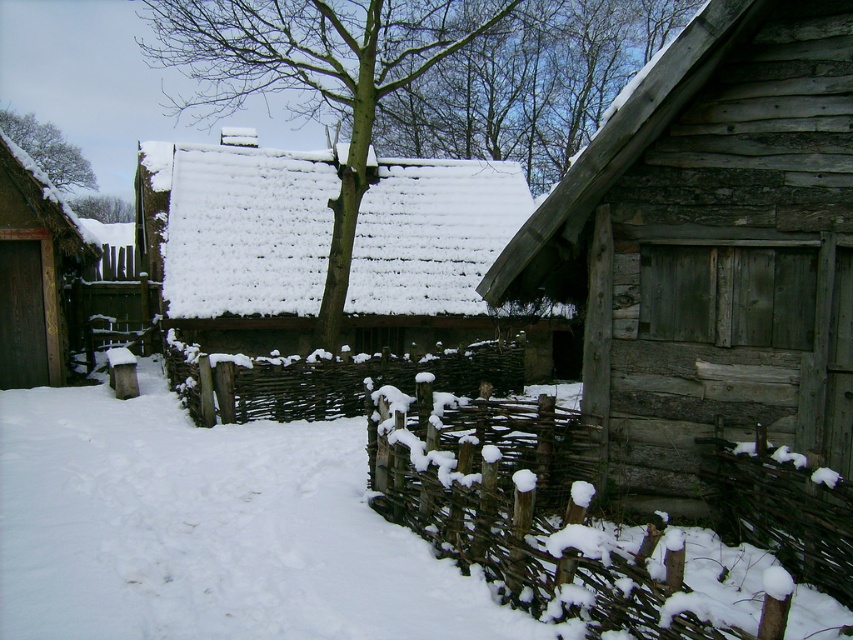
From the picture: Which is above, brown wooden fence at lower right or dark brown wooden door at left?

dark brown wooden door at left

Can you confirm if brown wooden fence at lower right is positioned above dark brown wooden door at left?

Incorrect, brown wooden fence at lower right is not positioned above dark brown wooden door at left.

Who is more distant from viewer, [811,524] or [26,348]?

The point [26,348] is more distant.

Identify the location of brown wooden fence at lower right. (781, 508).

Can you confirm if green textured tree at center is positioned to the left of snow-covered wooden cabin at center?

In fact, green textured tree at center is to the right of snow-covered wooden cabin at center.

Is green textured tree at center above snow-covered wooden cabin at center?

Yes.

At what (x,y) coordinates should I click in order to perform the action: click on green textured tree at center. Please return your answer as a coordinate pair (x, y). Image resolution: width=853 pixels, height=640 pixels. Looking at the image, I should click on (416, 76).

Is green textured tree at center closer to camera compared to green leafy tree at upper center?

That is True.

Does point (434, 24) lie in front of point (94, 198)?

That is True.

Identify the location of green textured tree at center. (416, 76).